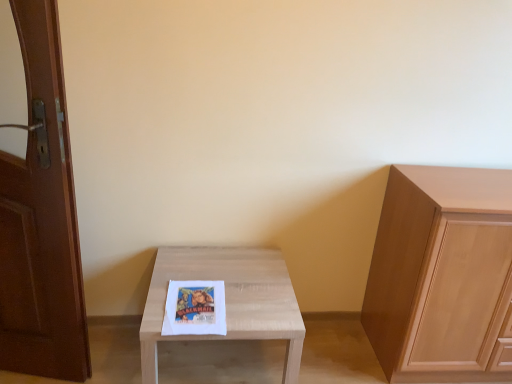
Find the location of a particular element. The width and height of the screenshot is (512, 384). free spot above light wood table at center (from a real-world perspective) is located at coordinates (223, 283).